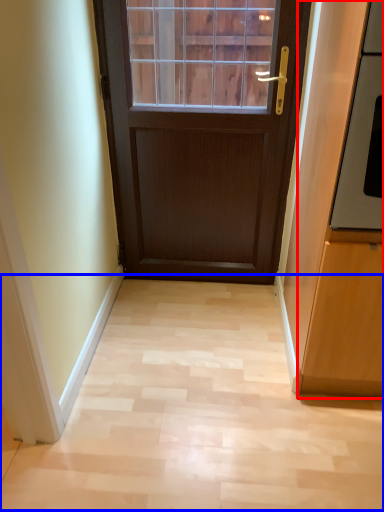
Question: Which point is closer to the camera, cabinetry (highlighted by a red box) or corridor (highlighted by a blue box)?

Choices:
 (A) cabinetry
 (B) corridor

Answer: (A)